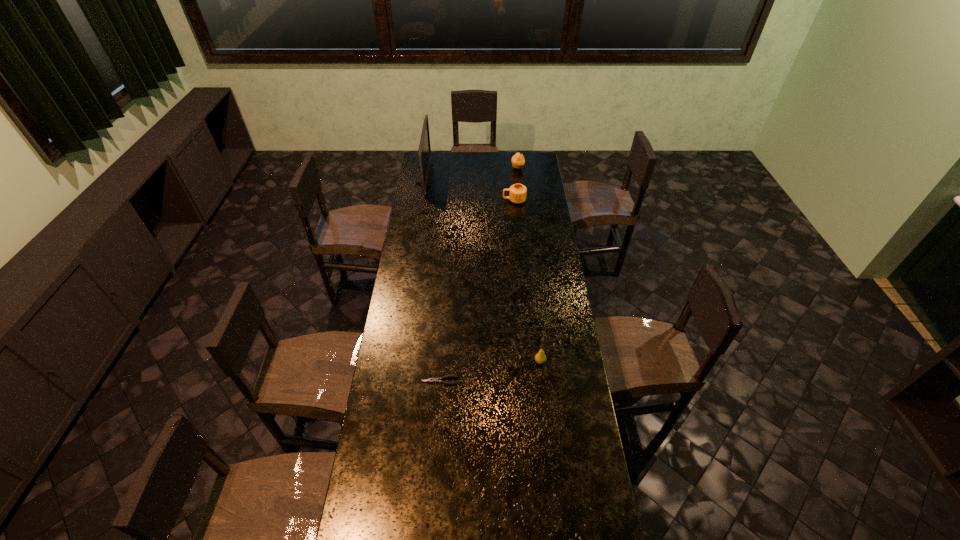
Locate an element on the screen. The width and height of the screenshot is (960, 540). free space that is in between the leftmost object and the farther pear is located at coordinates click(x=471, y=172).

Choose which object is the nearest neighbor to the monitor. Please provide its 2D coordinates. Your answer should be formatted as a tuple, i.e. [(x, y)], where the tuple contains the x and y coordinates of a point satisfying the conditions above.

[(517, 193)]

This screenshot has height=540, width=960. In order to click on object that is the second closest to the pliers in this screenshot , I will do `click(517, 193)`.

At what (x,y) coordinates should I click in order to perform the action: click on vacant space that satisfies the following two spatial constraints: 1. on the back side of the second object from left to right; 2. on the screen side of the tallest object. Please return your answer as a coordinate pair (x, y). Looking at the image, I should click on (454, 177).